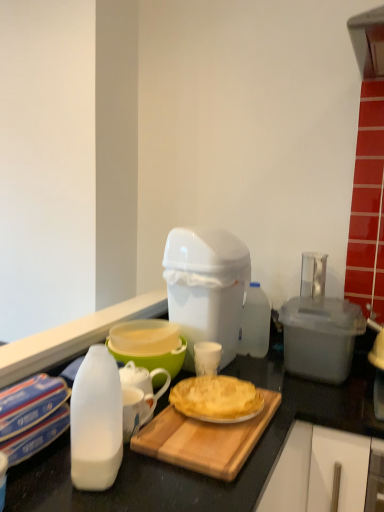
You are a GUI agent. You are given a task and a screenshot of the screen. Output one action in this format:
    pyautogui.click(x=<x>, y=<y>)
    Task: Click on the green plastic bowl at center
    
    Given the screenshot: What is the action you would take?
    pyautogui.click(x=154, y=358)

I want to click on white plastic trash can at center, the first appliance when ordered from left to right, so click(x=206, y=287).

At what (x,y) coordinates should I click in order to perform the action: click on golden flaky pie at center. Please return your answer as a coordinate pair (x, y). The image size is (384, 512). Looking at the image, I should click on (216, 399).

In order to face transparent plastic container at right, placed as the 2th appliance when sorted from left to right, should I rotate leftwards or rightwards?

Rotate your view right by about 16.469°.

What do you see at coordinates (255, 323) in the screenshot? The image size is (384, 512). I see `translucent plastic bottle at center-right` at bounding box center [255, 323].

Where is `green plastic bowl at center`? green plastic bowl at center is located at coordinates (154, 358).

From a real-world perspective, is translucent plastic bottle at center-right above or below green plastic bowl at center?

Clearly, from a real-world perspective, translucent plastic bottle at center-right is above green plastic bowl at center.

Can you confirm if translucent plastic bottle at center-right is bigger than green plastic bowl at center?

Actually, translucent plastic bottle at center-right might be smaller than green plastic bowl at center.

Is translucent plastic bottle at center-right not within green plastic bowl at center?

Yes, translucent plastic bottle at center-right is not within green plastic bowl at center.

Is translucent plastic bottle at center-right oriented towards golden flaky pie at center?

Yes, translucent plastic bottle at center-right is oriented towards golden flaky pie at center.

Is translucent plastic bottle at center-right shorter than golden flaky pie at center?

No, translucent plastic bottle at center-right is not shorter than golden flaky pie at center.

Is translucent plastic bottle at center-right placed right next to golden flaky pie at center?

No, translucent plastic bottle at center-right is not next to golden flaky pie at center.

Image resolution: width=384 pixels, height=512 pixels. What are the coordinates of `dessert lying on the left of translucent plastic bottle at center-right` in the screenshot? It's located at (216, 399).

Does transparent plastic container at right, the first appliance positioned from the right, appear on the right side of wooden cutting board at center?

Correct, you'll find transparent plastic container at right, the first appliance positioned from the right, to the right of wooden cutting board at center.

Is the depth of transparent plastic container at right, placed as the 2th appliance when sorted from left to right, greater than that of wooden cutting board at center?

That is True.

From a real-world perspective, is transparent plastic container at right, placed as the 2th appliance when sorted from left to right, physically located above or below wooden cutting board at center?

transparent plastic container at right, placed as the 2th appliance when sorted from left to right, is above wooden cutting board at center.

In the scene shown: Does transparent plastic container at right, the first appliance positioned from the right, have a lesser width compared to wooden cutting board at center?

Indeed, transparent plastic container at right, the first appliance positioned from the right, has a lesser width compared to wooden cutting board at center.

Looking at this image, considering the sizes of white plastic trash can at center, marked as the second appliance in a right-to-left arrangement, and translucent plastic bottle at center-right in the image, is white plastic trash can at center, marked as the second appliance in a right-to-left arrangement, wider or thinner than translucent plastic bottle at center-right?

Clearly, white plastic trash can at center, marked as the second appliance in a right-to-left arrangement, has more width compared to translucent plastic bottle at center-right.

Looking at the image, does white plastic trash can at center, the first appliance when ordered from left to right, seem bigger or smaller compared to translucent plastic bottle at center-right?

white plastic trash can at center, the first appliance when ordered from left to right, is bigger than translucent plastic bottle at center-right.

From a real-world perspective, is white plastic trash can at center, the first appliance when ordered from left to right, above or below translucent plastic bottle at center-right?

From a real-world perspective, white plastic trash can at center, the first appliance when ordered from left to right, is physically above translucent plastic bottle at center-right.

Is translucent plastic bottle at center-right at the back of white plastic trash can at center, the first appliance when ordered from left to right?

No.

Which is more to the right, wooden cutting board at center or transparent plastic container at right, placed as the 2th appliance when sorted from left to right?

Positioned to the right is transparent plastic container at right, placed as the 2th appliance when sorted from left to right.

Does wooden cutting board at center come in front of transparent plastic container at right, placed as the 2th appliance when sorted from left to right?

Yes, it is in front of transparent plastic container at right, placed as the 2th appliance when sorted from left to right.

Is wooden cutting board at center positioned beyond the bounds of transparent plastic container at right, the first appliance positioned from the right?

Yes, wooden cutting board at center is not within transparent plastic container at right, the first appliance positioned from the right.

In the scene shown: Who is taller, wooden cutting board at center or transparent plastic container at right, the first appliance positioned from the right?

transparent plastic container at right, the first appliance positioned from the right, is taller.

How much distance is there between translucent plastic bottle at center-right and transparent plastic container at right, the first appliance positioned from the right?

translucent plastic bottle at center-right is 7.95 inches away from transparent plastic container at right, the first appliance positioned from the right.

Visually, is translucent plastic bottle at center-right positioned to the left or to the right of transparent plastic container at right, the first appliance positioned from the right?

From the image, it's evident that translucent plastic bottle at center-right is to the left of transparent plastic container at right, the first appliance positioned from the right.

Is translucent plastic bottle at center-right not inside transparent plastic container at right, the first appliance positioned from the right?

Absolutely, translucent plastic bottle at center-right is external to transparent plastic container at right, the first appliance positioned from the right.

Is point (255, 328) positioned in front of point (319, 377)?

No, (255, 328) is further to viewer.

Does golden flaky pie at center have a greater width compared to translucent plastic bottle at center-right?

Correct, the width of golden flaky pie at center exceeds that of translucent plastic bottle at center-right.

Which is correct: golden flaky pie at center is inside translucent plastic bottle at center-right, or outside of it?

golden flaky pie at center exists outside the volume of translucent plastic bottle at center-right.

Consider the image. Considering the sizes of objects golden flaky pie at center and translucent plastic bottle at center-right in the image provided, who is shorter, golden flaky pie at center or translucent plastic bottle at center-right?

golden flaky pie at center.

Is golden flaky pie at center next to translucent plastic bottle at center-right?

No, golden flaky pie at center is not next to translucent plastic bottle at center-right.

Locate an element on the screen. The width and height of the screenshot is (384, 512). bowl below the translucent plastic bottle at center-right (from the image's perspective) is located at coordinates (154, 358).

Locate an element on the screen. bottle to the right of golden flaky pie at center is located at coordinates coord(255,323).

Which object lies further to the anchor point translucent plastic bottle at center-right, green plastic bowl at center or wooden cutting board at center?

wooden cutting board at center is positioned further to the anchor translucent plastic bottle at center-right.

Which object lies further to the anchor point green plastic bowl at center, transparent plastic container at right, the first appliance positioned from the right, or golden flaky pie at center?

Among the two, transparent plastic container at right, the first appliance positioned from the right, is located further to green plastic bowl at center.

Looking at the image, which one is located closer to golden flaky pie at center, translucent plastic bottle at center-right or wooden cutting board at center?

Based on the image, wooden cutting board at center appears to be nearer to golden flaky pie at center.

From the image, which object appears to be nearer to green plastic bowl at center, golden flaky pie at center or translucent plastic bottle at center-right?

golden flaky pie at center lies closer to green plastic bowl at center than the other object.

Looking at the image, which one is located further to translucent plastic bottle at center-right, wooden cutting board at center or golden flaky pie at center?

The object further to translucent plastic bottle at center-right is wooden cutting board at center.

When comparing their distances from transparent plastic container at right, placed as the 2th appliance when sorted from left to right, does golden flaky pie at center or white plastic trash can at center, marked as the second appliance in a right-to-left arrangement, seem closer?

Among the two, white plastic trash can at center, marked as the second appliance in a right-to-left arrangement, is located nearer to transparent plastic container at right, placed as the 2th appliance when sorted from left to right.

In the scene shown: Estimate the real-world distances between objects in this image. Which object is closer to green plastic bowl at center, white plastic trash can at center, marked as the second appliance in a right-to-left arrangement, or golden flaky pie at center?

The object closer to green plastic bowl at center is golden flaky pie at center.

From the image, which object appears to be nearer to white plastic trash can at center, the first appliance when ordered from left to right, transparent plastic container at right, placed as the 2th appliance when sorted from left to right, or translucent plastic bottle at center-right?

translucent plastic bottle at center-right.

Identify the location of bowl between wooden cutting board at center and white plastic trash can at center, marked as the second appliance in a right-to-left arrangement, along the z-axis. (154, 358).

The image size is (384, 512). Find the location of `bottle located between white plastic trash can at center, the first appliance when ordered from left to right, and transparent plastic container at right, the first appliance positioned from the right, in the left-right direction`. bottle located between white plastic trash can at center, the first appliance when ordered from left to right, and transparent plastic container at right, the first appliance positioned from the right, in the left-right direction is located at coordinates tap(255, 323).

Where is `bowl between wooden cutting board at center and translucent plastic bottle at center-right in the front-back direction`? This screenshot has width=384, height=512. bowl between wooden cutting board at center and translucent plastic bottle at center-right in the front-back direction is located at coordinates (154, 358).

Where is `dessert located between wooden cutting board at center and transparent plastic container at right, the first appliance positioned from the right, in the depth direction`? dessert located between wooden cutting board at center and transparent plastic container at right, the first appliance positioned from the right, in the depth direction is located at coordinates (216, 399).